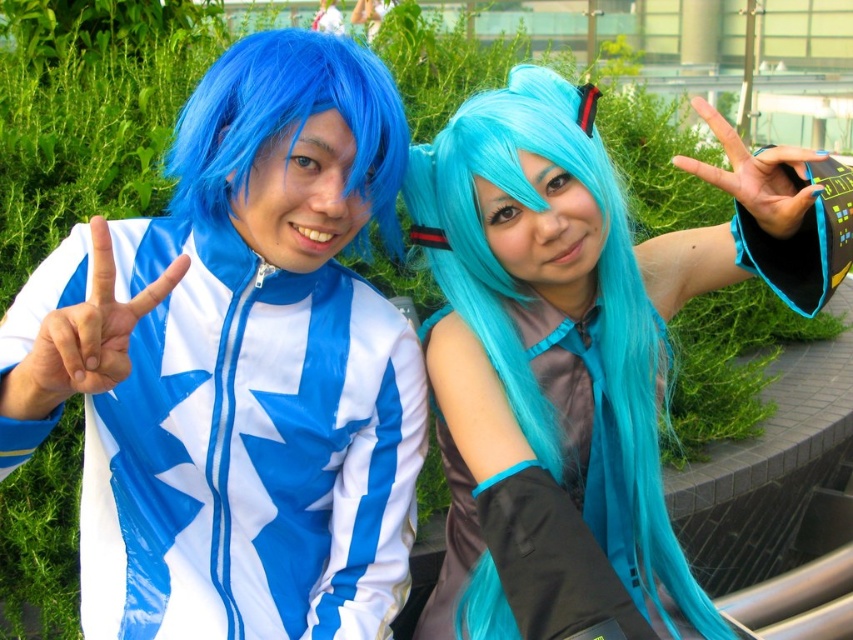
You are a photographer at a cosplay event and need to adjust the lighting to ensure both the teal glossy wig at center and the satin teal dress at center are well lit. Which object should you focus the light on first if the wig is to the right of the dress?

The teal glossy wig at center is positioned on the right side of the satin teal dress at center, so you should focus the light on the satin teal dress at center first since it is to the left and might be in the shadow if the wig is blocking light from the right side.

You are a photographer at a cosplay event. You need to decide whether the shiny plastic jacket at center will fit in a storage box designed for items narrower than the blue synthetic wig at left. Based on the scene, can the jacket fit in the box?

The shiny plastic jacket at center is wider than the blue synthetic wig at left, so it will not fit in the storage box designed for items narrower than the blue synthetic wig at left.

You are standing in front of the two cosplayers. You want to take a photo of the shiny plastic jacket at center. Where should you position yourself to capture it in the frame?

The shiny plastic jacket at center is located at point (248, 451), so you should position yourself directly facing that coordinate to capture it in the frame.